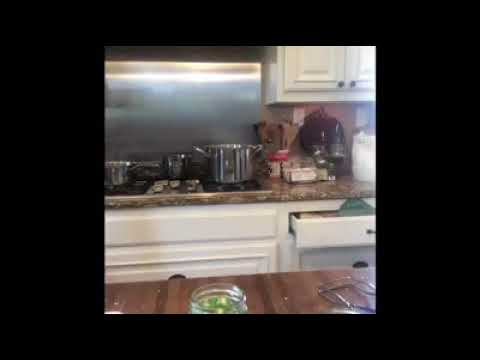
Where is `jar`? jar is located at coordinates (229, 297).